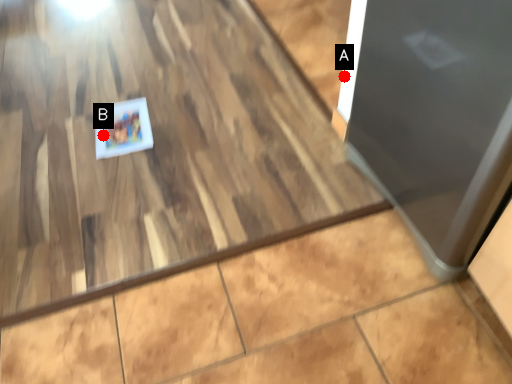
Question: Two points are circled on the image, labeled by A and B beside each circle. Which of the following is the closest to the observer?

Choices:
 (A) A is closer
 (B) B is closer

Answer: (A)